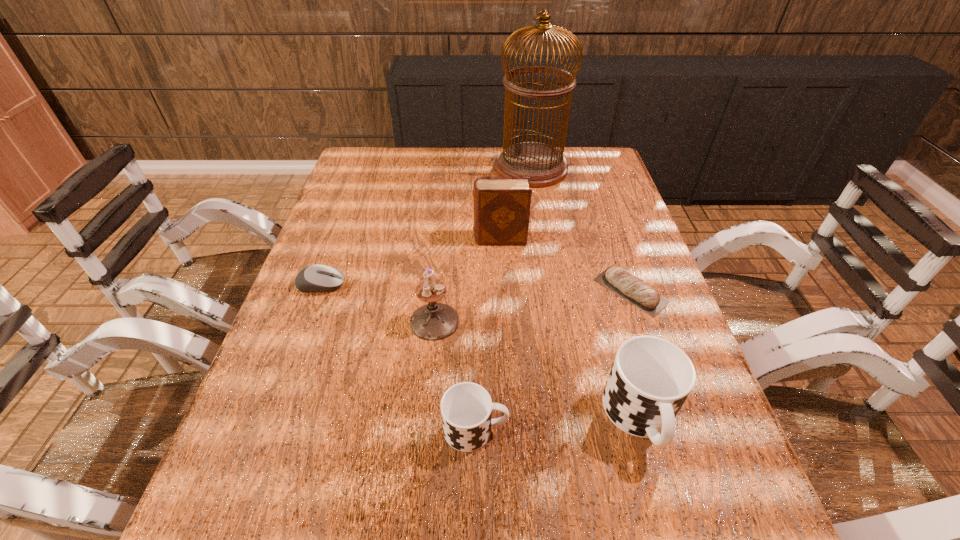
The image size is (960, 540). Identify the location of the shorter cup. (466, 408).

Find the location of a particular element. the third shortest object is located at coordinates coord(466,408).

Where is `the fourth shortest object`? The height and width of the screenshot is (540, 960). the fourth shortest object is located at coordinates (650, 379).

Find the location of a particular element. The image size is (960, 540). the right cup is located at coordinates (650, 379).

At what (x,y) coordinates should I click in order to perform the action: click on the farthest object. Please return your answer as a coordinate pair (x, y). The width and height of the screenshot is (960, 540). Looking at the image, I should click on (546, 165).

The width and height of the screenshot is (960, 540). Find the location of `birdcage`. birdcage is located at coordinates (546, 165).

Where is `candle holder`? Image resolution: width=960 pixels, height=540 pixels. candle holder is located at coordinates (434, 321).

At what (x,y) coordinates should I click in order to perform the action: click on diary. Please return your answer as a coordinate pair (x, y). This screenshot has width=960, height=540. Looking at the image, I should click on (502, 205).

Identify the location of computer equipment. The height and width of the screenshot is (540, 960). (315, 278).

What are the coordinates of `pita bread` in the screenshot? It's located at (617, 279).